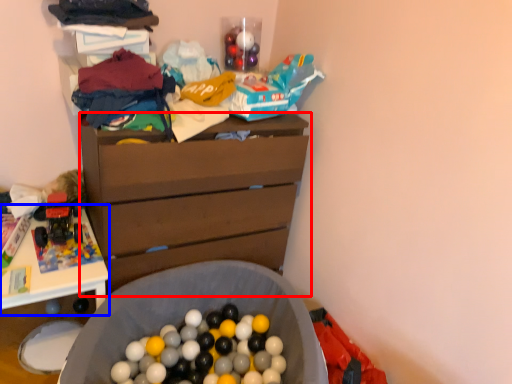
Question: Among these objects, which one is farthest to the camera, chest of drawers (highlighted by a red box) or table (highlighted by a blue box)?

Choices:
 (A) chest of drawers
 (B) table

Answer: (A)